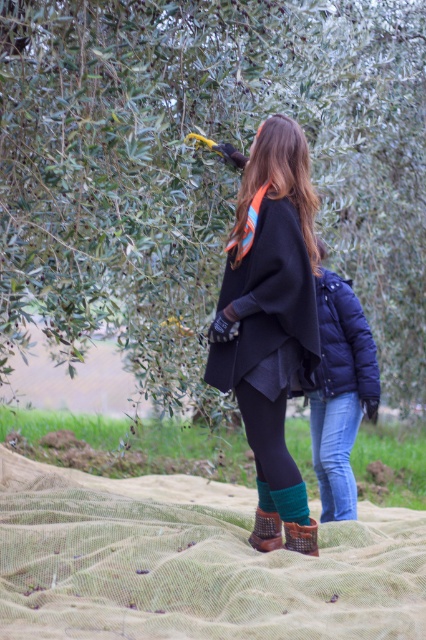
You are a delivery robot with a width of 1 meter. You need to move from the blue down jacket at center to the green suede boot at lower center. Is there enough space for you to pass through the gap between them?

The distance between the blue down jacket at center and green suede boot at lower center is 1.18 meters, so yes, the robot can pass through the gap since it is wider than the robot.

You are an olive farmer checking the harvest progress. You see the dark blue puffer jacket at center and the green suede boot at lower center. Which object is closer to you?

The dark blue puffer jacket at center is closer to you because it is further to the viewer than the green suede boot at lower center.

In the scene shown: You are in an olive grove and need to find the blue down jacket at center. According to the scene description, where should you look to locate it?

The blue down jacket at center is located at point (339, 390) in the image coordinates.